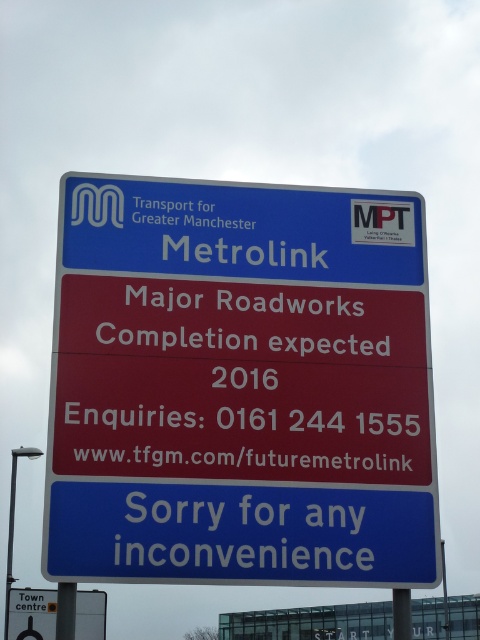
You are standing at the Metrolink station and see the blue plastic signboard at upper center and the yellow plastic sign at lower left. Which one is bigger in size?

The blue plastic signboard at upper center is smaller than the yellow plastic sign at lower left, so the yellow plastic sign at lower left is bigger in size.

From the picture: You are standing at point A at coordinates (x=259, y=264) and want to reach point B. The distance between them is 24.56 meters. If your walking speed is 1.5 meters per second, how long will it take you to walk from point A to point B?

The distance between point A at coordinates (x=259, y=264) and point B is 24.56 meters. At a walking speed of 1.5 meters per second, it will take approximately 16.37 seconds to walk from point A to point B.

You are a pedestrian standing in front of the Metrolink road sign. You notice the blue plastic signboard at upper center and the yellow plastic sign at lower left. Which of these two signs is narrower in width?

The blue plastic signboard at upper center is thinner than the yellow plastic sign at lower left, so it is narrower in width.